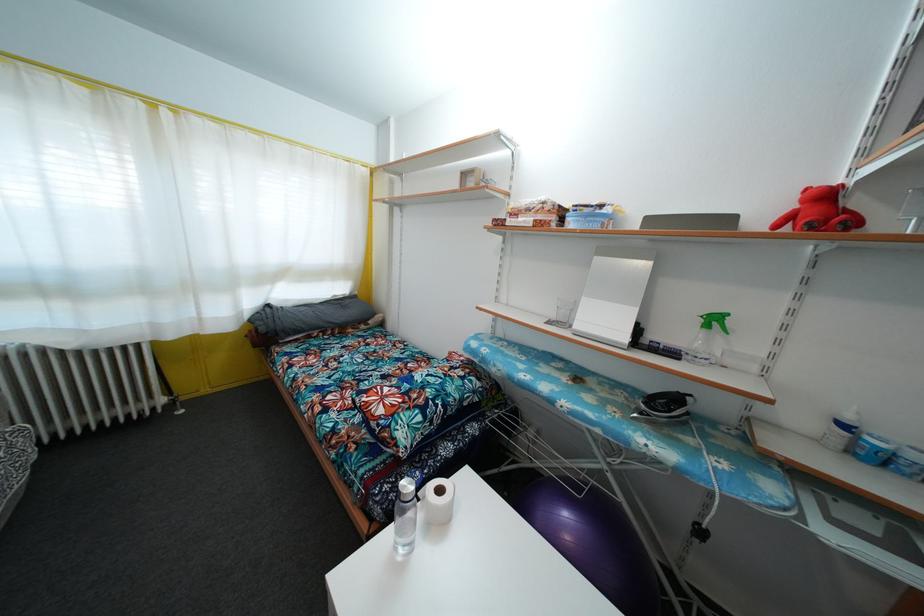
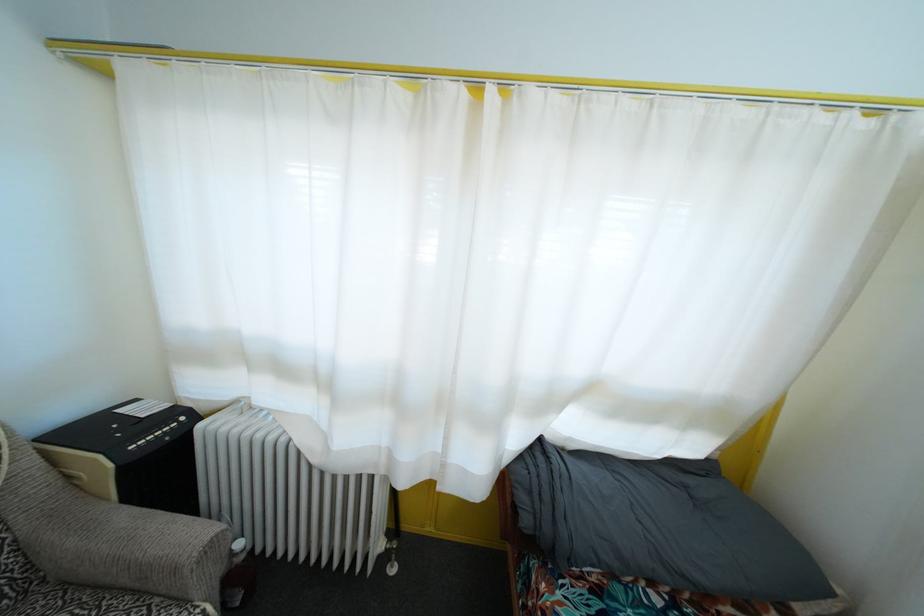
Locate, in the second image, the point that corresponds to (x=193, y=272) in the first image.

(457, 379)